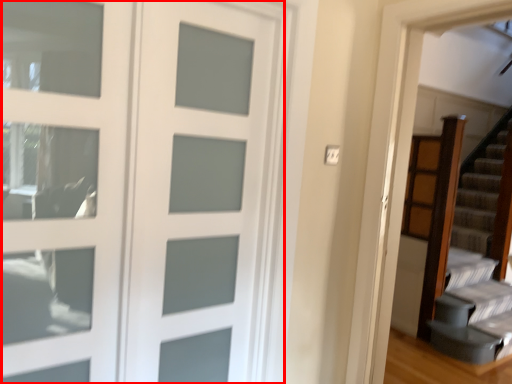
Question: From the image's perspective, what is the correct spatial positioning of door (annotated by the red box) in reference to screen door?

Choices:
 (A) above
 (B) below

Answer: (B)